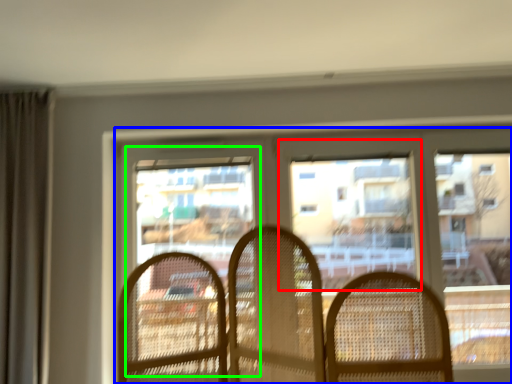
Question: Which object is positioned closest to window screen (highlighted by a red box)? Select from window (highlighted by a blue box) and screen door (highlighted by a green box).

Choices:
 (A) window
 (B) screen door

Answer: (A)